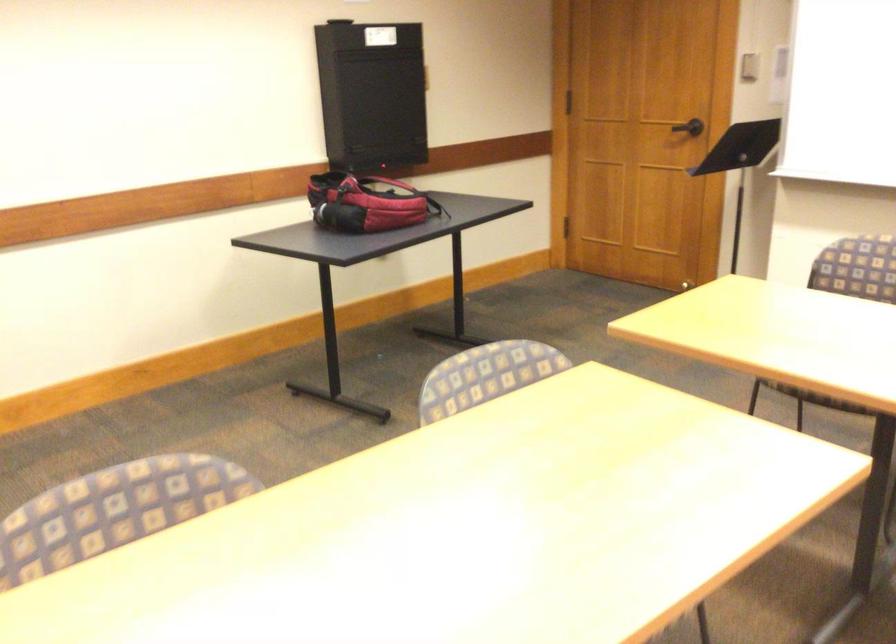
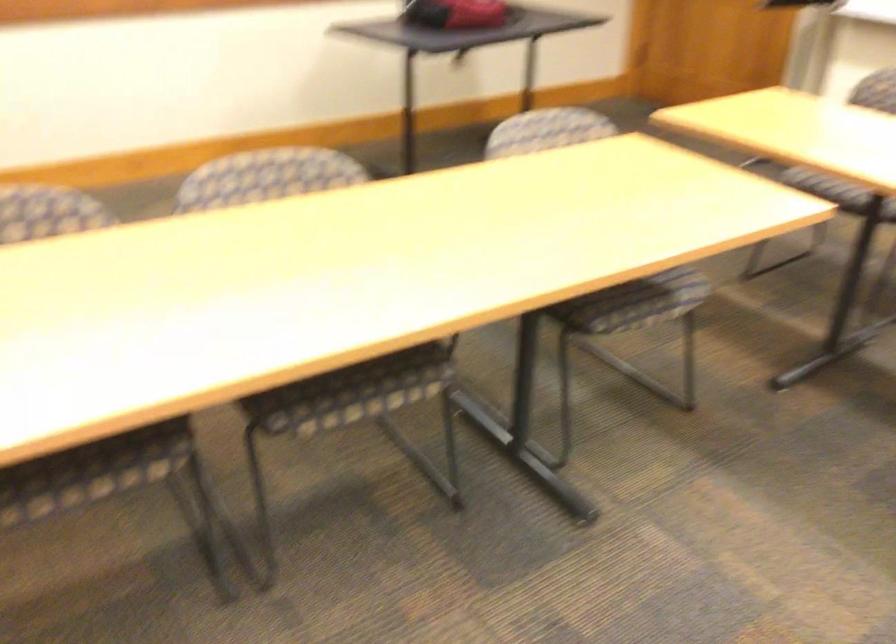
Question: What movement of the cameraman would produce the second image?

Choices:
 (A) Left
 (B) Right
 (C) Forward
 (D) Backward

Answer: (D)